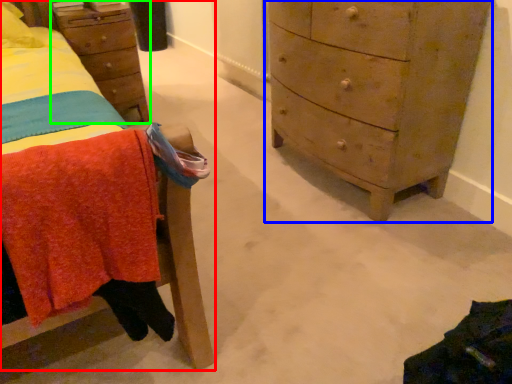
Question: Which object is the farthest from furniture (highlighted by a red box)? Choose among these: chest of drawers (highlighted by a blue box) or nightstand (highlighted by a green box).

Choices:
 (A) chest of drawers
 (B) nightstand

Answer: (A)